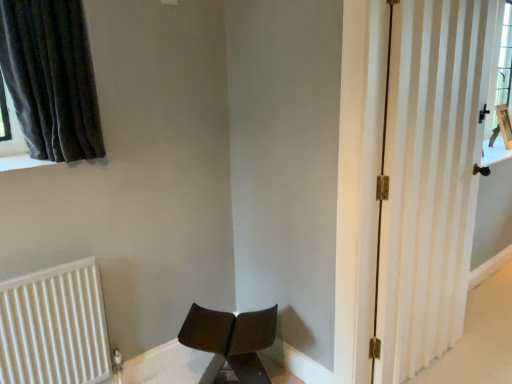
Question: Considering the relative sizes of dark grey fabric curtain at upper left and white striped door at right in the image provided, is dark grey fabric curtain at upper left bigger than white striped door at right?

Choices:
 (A) no
 (B) yes

Answer: (A)

Question: Is dark grey fabric curtain at upper left at the left side of white striped door at right?

Choices:
 (A) yes
 (B) no

Answer: (A)

Question: Can you confirm if dark grey fabric curtain at upper left is taller than white striped door at right?

Choices:
 (A) no
 (B) yes

Answer: (A)

Question: From a real-world perspective, is dark grey fabric curtain at upper left located beneath white striped door at right?

Choices:
 (A) no
 (B) yes

Answer: (A)

Question: Is dark grey fabric curtain at upper left surrounding white striped door at right?

Choices:
 (A) no
 (B) yes

Answer: (A)

Question: Is dark grey fabric curtain at upper left positioned with its back to white striped door at right?

Choices:
 (A) no
 (B) yes

Answer: (A)

Question: Can you see dark grey fabric curtain at upper left touching white ribbed radiator at lower left?

Choices:
 (A) yes
 (B) no

Answer: (B)

Question: From the image's perspective, is dark grey fabric curtain at upper left on top of white ribbed radiator at lower left?

Choices:
 (A) no
 (B) yes

Answer: (B)

Question: Is dark grey fabric curtain at upper left thinner than white ribbed radiator at lower left?

Choices:
 (A) yes
 (B) no

Answer: (B)

Question: Is dark grey fabric curtain at upper left positioned behind white ribbed radiator at lower left?

Choices:
 (A) yes
 (B) no

Answer: (B)

Question: Does dark grey fabric curtain at upper left have a greater height compared to white ribbed radiator at lower left?

Choices:
 (A) no
 (B) yes

Answer: (A)

Question: Considering the relative sizes of dark grey fabric curtain at upper left and white ribbed radiator at lower left in the image provided, is dark grey fabric curtain at upper left shorter than white ribbed radiator at lower left?

Choices:
 (A) yes
 (B) no

Answer: (A)

Question: Does white striped door at right have a lesser height compared to white ribbed radiator at lower left?

Choices:
 (A) no
 (B) yes

Answer: (A)